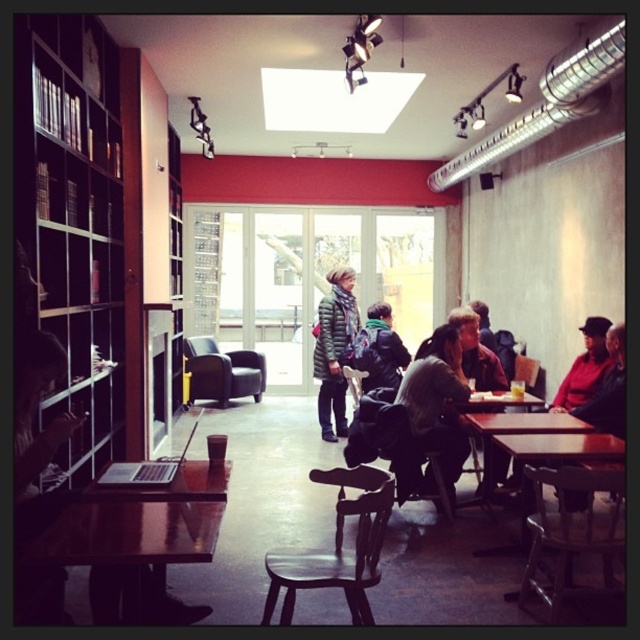
Is wooden bookshelf at left closer to camera compared to green down jacket at center?

Yes, it is.

Which is behind, point (38, 182) or point (348, 310)?

Point (348, 310)

Find the location of a particular element. wooden bookshelf at left is located at coordinates pyautogui.click(x=74, y=218).

Which is more to the left, wooden table at lower left or green down jacket at center?

From the viewer's perspective, wooden table at lower left appears more on the left side.

In the scene shown: Is wooden table at lower left smaller than green down jacket at center?

Yes.

Which is behind, point (93, 545) or point (333, 337)?

Point (333, 337)

The height and width of the screenshot is (640, 640). Identify the location of wooden table at lower left. pyautogui.click(x=131, y=536).

Who is more forward, (35, 529) or (595, 337)?

Positioned in front is point (35, 529).

Between matte black laptop at left and dark brown leather jacket at right, which one appears on the left side from the viewer's perspective?

Positioned to the left is matte black laptop at left.

Is point (32, 516) closer to viewer compared to point (595, 380)?

That is True.

At what (x,y) coordinates should I click in order to perform the action: click on matte black laptop at left. Please return your answer as a coordinate pair (x, y). Looking at the image, I should click on tap(38, 432).